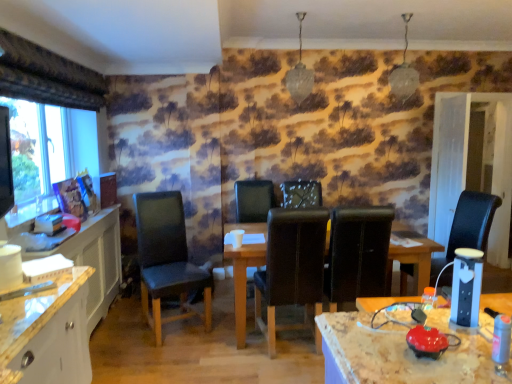
The image size is (512, 384). In order to click on vacant space in front of dark blue leather chair at center, which ranks as the 1th chair in left-to-right order in this screenshot , I will do `click(168, 354)`.